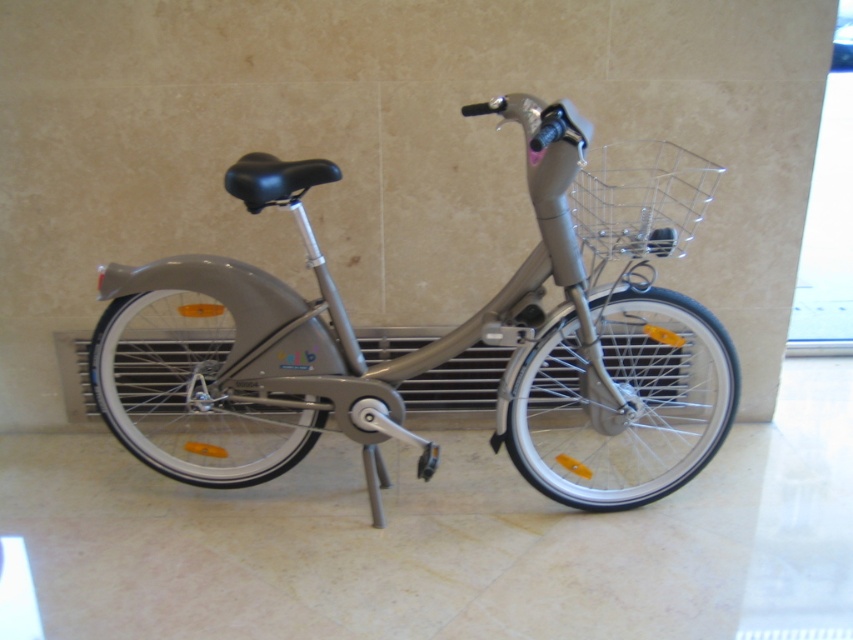
You are a delivery person who needs to park your metallic gray bicycle at center in a specific spot marked at coordinates 0.5, 0.5. Can you determine if the bicycle is already parked correctly based on its current position?

The metallic gray bicycle at center is positioned at point (440,337), which is very close to the target coordinates (426,320). Depending on the required precision, it might be considered correctly parked.

What object is located at the coordinates point (440, 337) in the image?

The metallic gray bicycle at center is located at the coordinates point (440, 337).